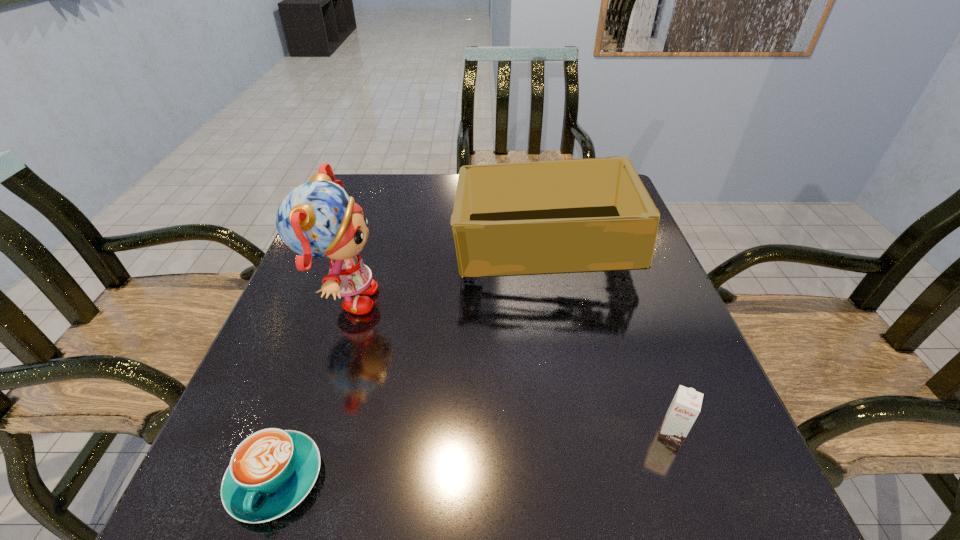
I want to click on free space between the doll and the second shortest object, so click(x=508, y=367).

This screenshot has width=960, height=540. Find the location of `free space between the tallest object and the box`. free space between the tallest object and the box is located at coordinates (446, 273).

Identify the location of free space between the cappuccino and the second tallest object. This screenshot has width=960, height=540. point(413,362).

Find the location of `vacant point located between the shortest object and the doll`. vacant point located between the shortest object and the doll is located at coordinates (309, 390).

Where is `vacant area that lies between the third tallest object and the shortest object`? vacant area that lies between the third tallest object and the shortest object is located at coordinates (473, 456).

I want to click on blank region between the third tallest object and the box, so click(611, 339).

Locate an element on the screen. Image resolution: width=960 pixels, height=540 pixels. free space between the third tallest object and the tallest object is located at coordinates (508, 367).

At what (x,y) coordinates should I click in order to perform the action: click on free space that is in between the chocolate milk and the box. Please return your answer as a coordinate pair (x, y). The width and height of the screenshot is (960, 540). Looking at the image, I should click on (611, 339).

Identify the location of vacant space in between the doll and the cappuccino. The image size is (960, 540). (309, 390).

You are a GUI agent. You are given a task and a screenshot of the screen. Output one action in this format:
    pyautogui.click(x=<x>, y=<y>)
    Task: Click on the empty space between the second shortest object and the second tallest object
    The image size is (960, 540).
    Given the screenshot: What is the action you would take?
    pyautogui.click(x=611, y=339)